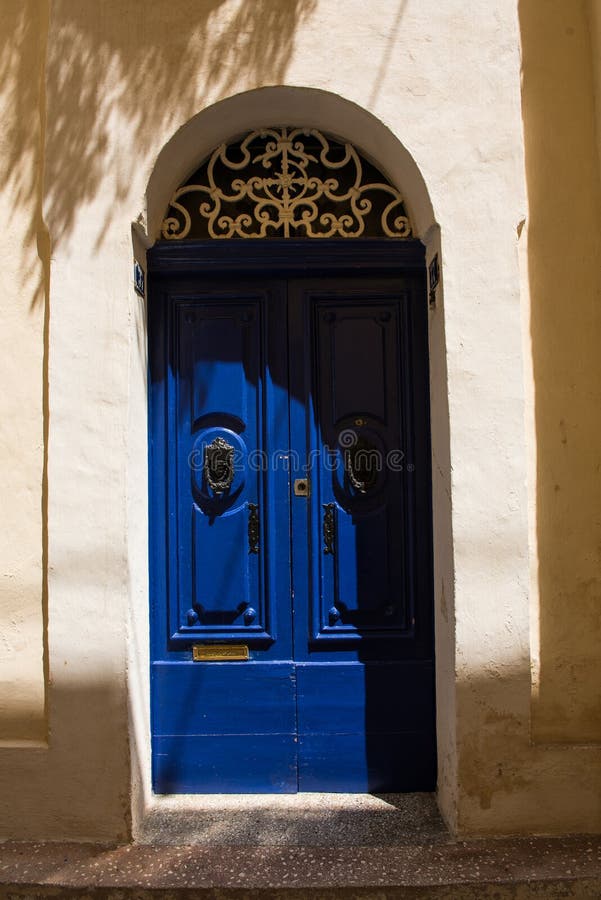
This screenshot has width=601, height=900. I want to click on right door, so click(353, 586).